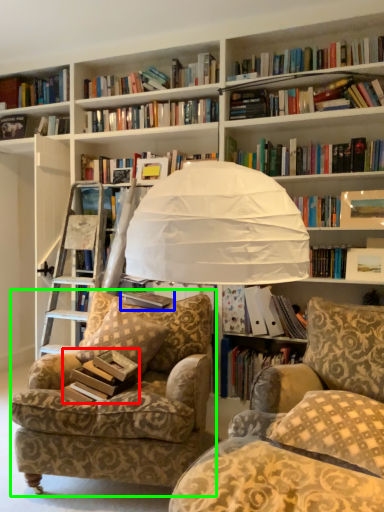
Question: Considering the real-world distances, which object is closest to paperback book (highlighted by a red box)? book (highlighted by a blue box) or chair (highlighted by a green box).

Choices:
 (A) book
 (B) chair

Answer: (B)